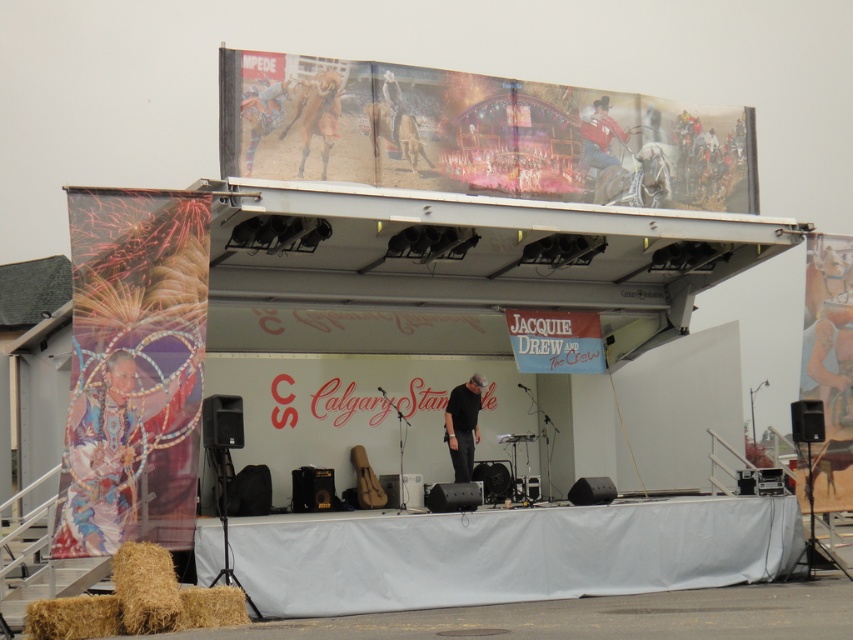
Looking at this image, you are an event photographer at the rodeo festival. You need to capture a photo that includes both the beaded fabric person at left and the black fabric at center. Which object should you focus on first to ensure both are in frame?

The beaded fabric person at left is closer to the viewer than the black fabric at center, so focus on the beaded fabric person at left first to ensure both are in frame.

You are a photographer at the rodeo event. You need to capture a photo that includes both the beaded fabric person at left and the red leather cowboy at center. Which one should you focus on first to ensure both are in frame?

The beaded fabric person at left is in front of the red leather cowboy at center, so you should focus on the red leather cowboy at center first to ensure both are in frame.